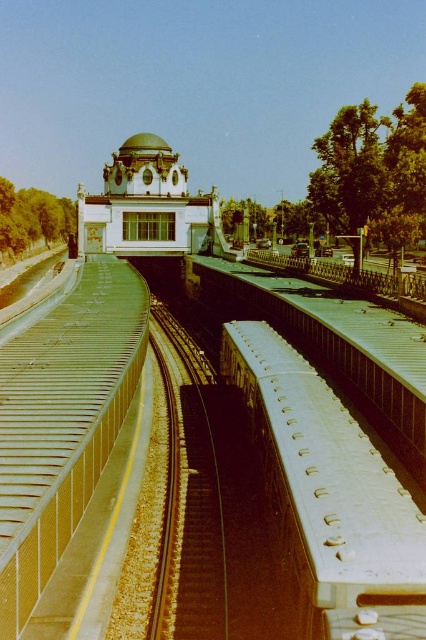
Question: Which object appears closest to the camera in this image?

Choices:
 (A) white matte train at center
 (B) smooth metal train track at center

Answer: (A)

Question: Can you confirm if white matte train at center is smaller than smooth metal train track at center?

Choices:
 (A) yes
 (B) no

Answer: (A)

Question: Does white matte train at center have a larger size compared to smooth metal train track at center?

Choices:
 (A) yes
 (B) no

Answer: (B)

Question: Is white matte train at center positioned at the back of smooth metal train track at center?

Choices:
 (A) yes
 (B) no

Answer: (B)

Question: Which point appears closest to the camera in this image?

Choices:
 (A) (166, 541)
 (B) (270, 472)

Answer: (B)